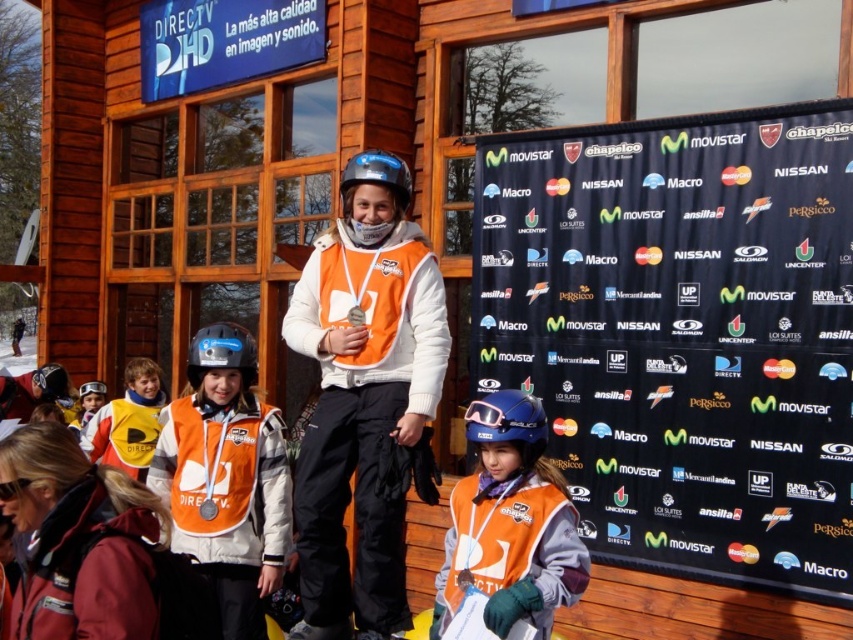
You are a photographer at the event and need to position yourself so that the orange matte vest at center and the black fabric banner at center are both visible in your shot. Based on their positions, which object should you place closer to the left side of your frame to ensure both are captured?

Since the black fabric banner at center is to the right of the orange matte vest at center, you should position the orange matte vest at center closer to the left side of your frame to include both in the shot.

In the scene of the children skiing event, you want to hang a new banner that is the same size as the orange matte vest at center. Can you determine if the black fabric banner at center can be used as a template for this new banner?

The black fabric banner at center has a larger size compared to orange matte vest at center. Therefore, the black fabric banner at center cannot be used as a template for the new banner since it is bigger than the orange matte vest at center.